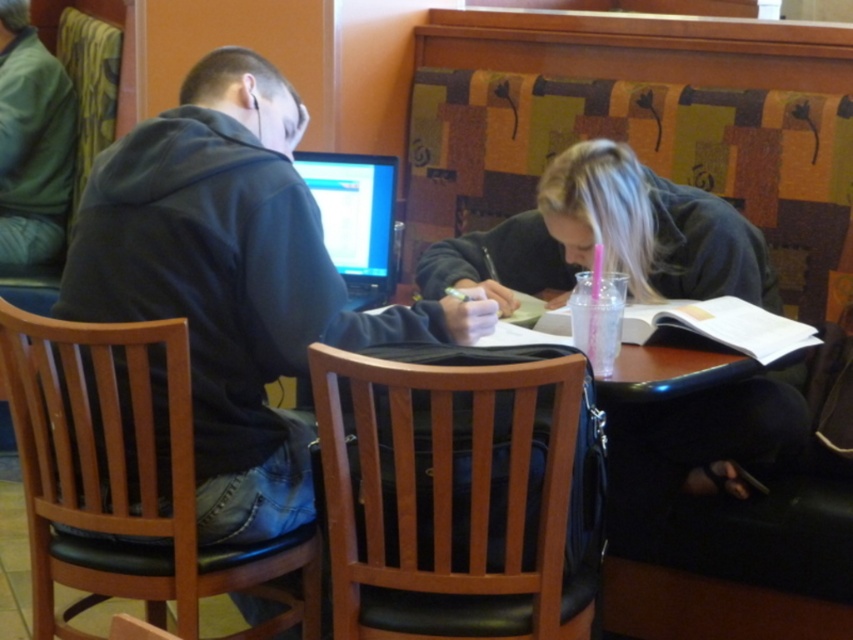
You are taking a photo of the scene and want to focus on both the computer screen and the notebook. The computer screen is at point (491, 230) and the notebook is at point (337, 241). Which object is closer to the camera?

Point (491, 230) is further to the camera than point (337, 241). Therefore, the notebook at point (337, 241) is closer to the camera than the computer screen at point (491, 230).

You are a customer in a store and you see two hoodies displayed on the wall. The dark blue hoodie at left and the green fleece hoodie at left. Which one is positioned to the right?

The dark blue hoodie at left is positioned to the right of the green fleece hoodie at left.

You are a photographer trying to capture a closeup of the matte black laptop at center without including the dark blue hoodie at left in the frame. Based on their positions, is this possible?

The dark blue hoodie at left is positioned on the left side of matte black laptop at center, so if you position yourself to the right of the laptop and zoom in, you can exclude the hoodie from the frame.